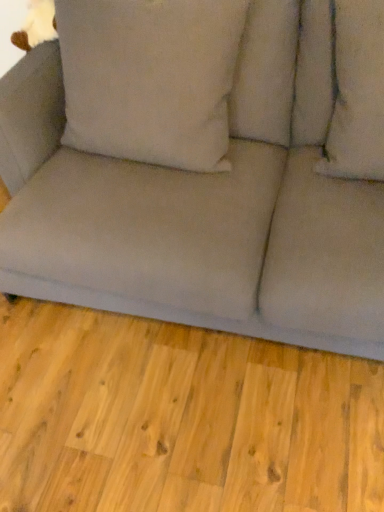
Question: Does beige fabric pillow at center, which is counted as the first pillow, starting from the left, have a lesser height compared to soft beige cushion at upper right, the first pillow positioned from the right?

Choices:
 (A) no
 (B) yes

Answer: (A)

Question: Considering the relative sizes of beige fabric pillow at center, the second pillow from the right, and soft beige cushion at upper right, which ranks as the second pillow in left-to-right order, in the image provided, is beige fabric pillow at center, the second pillow from the right, bigger than soft beige cushion at upper right, which ranks as the second pillow in left-to-right order,?

Choices:
 (A) no
 (B) yes

Answer: (B)

Question: From a real-world perspective, is beige fabric pillow at center, the second pillow from the right, on top of soft beige cushion at upper right, the first pillow positioned from the right?

Choices:
 (A) no
 (B) yes

Answer: (B)

Question: Can you confirm if beige fabric pillow at center, the second pillow from the right, is positioned to the right of soft beige cushion at upper right, the first pillow positioned from the right?

Choices:
 (A) no
 (B) yes

Answer: (A)

Question: Considering the relative positions of beige fabric pillow at center, the second pillow from the right, and soft beige cushion at upper right, the first pillow positioned from the right, in the image provided, is beige fabric pillow at center, the second pillow from the right, behind soft beige cushion at upper right, the first pillow positioned from the right,?

Choices:
 (A) yes
 (B) no

Answer: (A)

Question: From the image's perspective, is beige fabric pillow at center, the second pillow from the right, under soft beige cushion at upper right, the first pillow positioned from the right?

Choices:
 (A) no
 (B) yes

Answer: (A)

Question: From the image's perspective, is soft beige cushion at upper right, the first pillow positioned from the right, on gray fabric couch at lower center?

Choices:
 (A) yes
 (B) no

Answer: (A)

Question: Could you tell me if soft beige cushion at upper right, the first pillow positioned from the right, is turned towards gray fabric couch at lower center?

Choices:
 (A) no
 (B) yes

Answer: (A)

Question: Considering the relative positions of soft beige cushion at upper right, which ranks as the second pillow in left-to-right order, and gray fabric couch at lower center in the image provided, is soft beige cushion at upper right, which ranks as the second pillow in left-to-right order, to the right of gray fabric couch at lower center from the viewer's perspective?

Choices:
 (A) yes
 (B) no

Answer: (A)

Question: Is soft beige cushion at upper right, which ranks as the second pillow in left-to-right order, not within gray fabric couch at lower center?

Choices:
 (A) no
 (B) yes

Answer: (B)

Question: From the image's perspective, is soft beige cushion at upper right, which ranks as the second pillow in left-to-right order, below gray fabric couch at lower center?

Choices:
 (A) yes
 (B) no

Answer: (B)

Question: Can you confirm if soft beige cushion at upper right, the first pillow positioned from the right, is smaller than gray fabric couch at lower center?

Choices:
 (A) yes
 (B) no

Answer: (A)

Question: Does matte gray couch at center have a larger size compared to soft beige cushion at upper right, which ranks as the second pillow in left-to-right order?

Choices:
 (A) yes
 (B) no

Answer: (A)